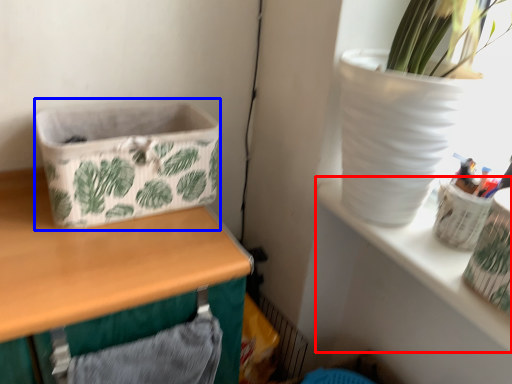
Question: Which object appears farthest to the camera in this image, shelf (highlighted by a red box) or basket container (highlighted by a blue box)?

Choices:
 (A) shelf
 (B) basket container

Answer: (B)